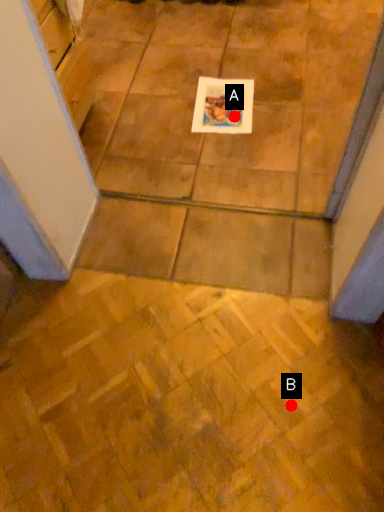
Question: Two points are circled on the image, labeled by A and B beside each circle. Which point is further to the camera?

Choices:
 (A) A is further
 (B) B is further

Answer: (A)